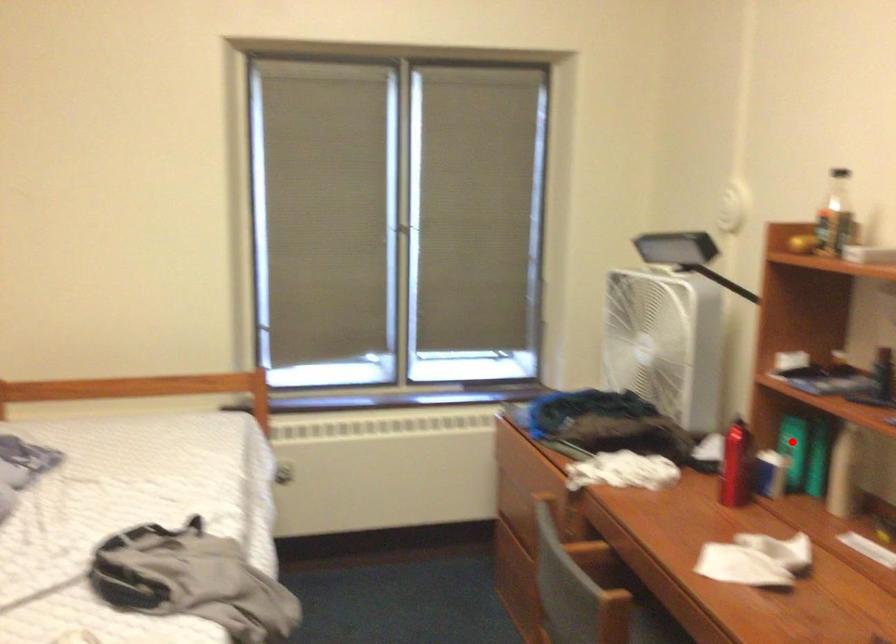
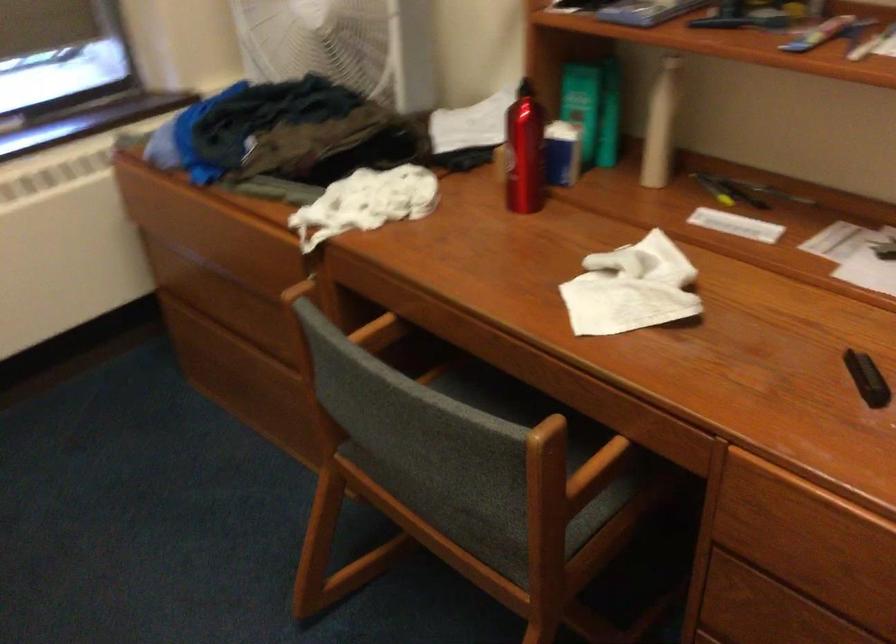
Question: I am providing you with two images of the same scene from different viewpoints. Image1 has a red point marked. In image2, the corresponding 3D location appears at what relative position? Reply with the corresponding letter.

Choices:
 (A) Closer
 (B) Farther

Answer: (A)